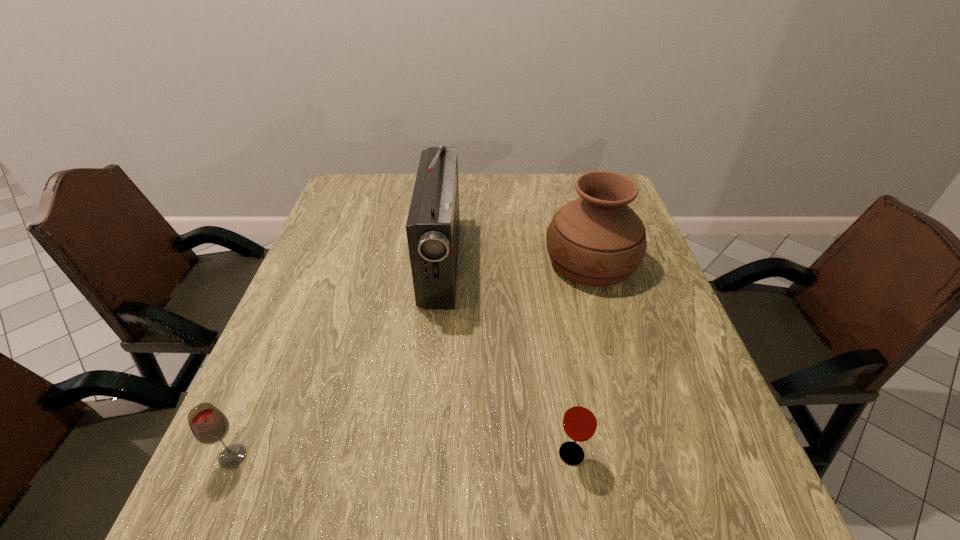
I want to click on vacant space that is in between the second object from left to right and the third shortest object, so click(516, 262).

This screenshot has width=960, height=540. I want to click on vacant point located between the third shortest object and the leftmost object, so click(x=412, y=359).

Where is `free point between the urn and the right glass drink container`? The height and width of the screenshot is (540, 960). free point between the urn and the right glass drink container is located at coordinates (581, 358).

This screenshot has height=540, width=960. I want to click on vacant area between the tallest object and the second tallest object, so click(x=516, y=262).

The height and width of the screenshot is (540, 960). What are the coordinates of `free space between the right glass drink container and the urn` in the screenshot? It's located at tap(581, 358).

The height and width of the screenshot is (540, 960). I want to click on free point between the second object from left to right and the leftmost object, so click(x=337, y=360).

In order to click on object that is the second nearest to the leftmost object in this screenshot , I will do `click(580, 420)`.

You are a GUI agent. You are given a task and a screenshot of the screen. Output one action in this format:
    pyautogui.click(x=<x>, y=<y>)
    Task: Click on the object that stands as the second closest to the tallest object
    
    Given the screenshot: What is the action you would take?
    pyautogui.click(x=580, y=420)

You are a GUI agent. You are given a task and a screenshot of the screen. Output one action in this format:
    pyautogui.click(x=<x>, y=<y>)
    Task: Click on the vacant space that satisfies the following two spatial constraints: 1. on the front-facing side of the tallest object; 2. on the front side of the left glass drink container
    This screenshot has height=540, width=960.
    Given the screenshot: What is the action you would take?
    pyautogui.click(x=421, y=456)

Locate an element on the screen. The height and width of the screenshot is (540, 960). blank area in the image that satisfies the following two spatial constraints: 1. on the back side of the right glass drink container; 2. on the right side of the third shortest object is located at coordinates (540, 262).